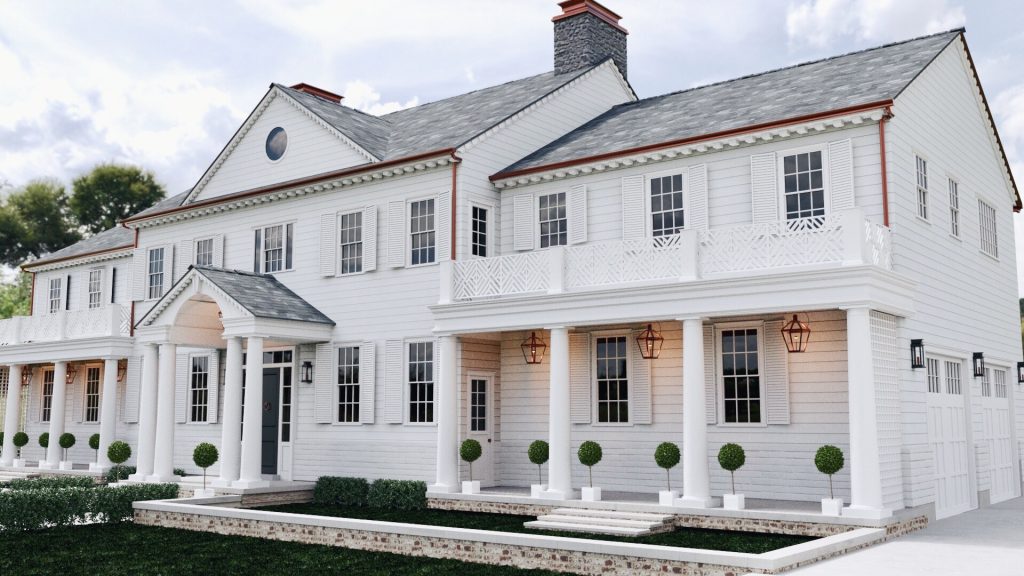
Find the location of a particular element. The width and height of the screenshot is (1024, 576). side door is located at coordinates (487, 445).